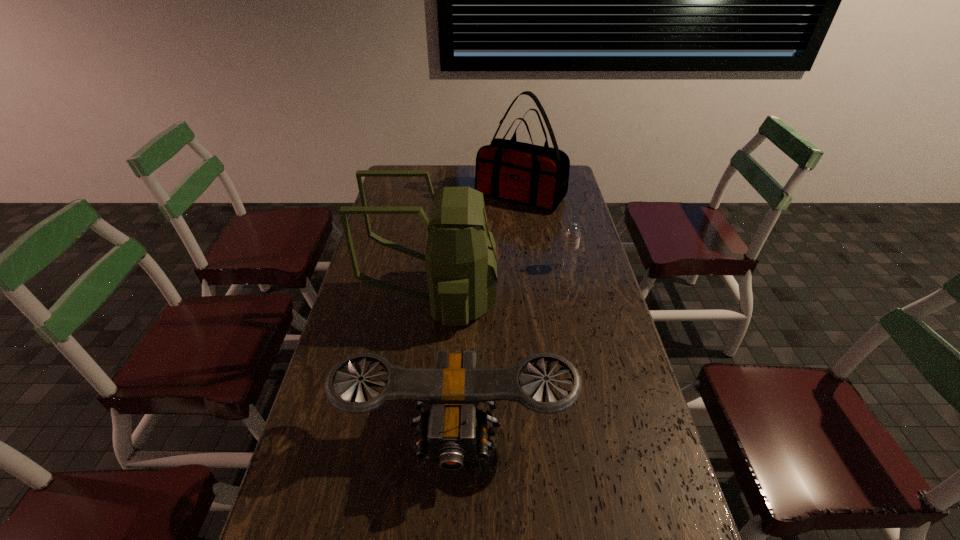
This screenshot has height=540, width=960. In order to click on drone that is positioned at the left edge in this screenshot , I will do `click(453, 426)`.

At what (x,y) coordinates should I click in order to perform the action: click on duffel bag situated at the right edge. Please return your answer as a coordinate pair (x, y). This screenshot has width=960, height=540. Looking at the image, I should click on (537, 176).

Find the location of a particular element. This screenshot has width=960, height=540. water bottle that is at the right edge is located at coordinates (570, 251).

Where is `object that is at the far right corner`? The height and width of the screenshot is (540, 960). object that is at the far right corner is located at coordinates (537, 176).

In order to click on vacant area at the far edge in this screenshot , I will do `click(432, 183)`.

Where is `free spot at the left edge of the desktop`? free spot at the left edge of the desktop is located at coordinates (401, 267).

This screenshot has height=540, width=960. I want to click on free spot at the right edge of the desktop, so click(553, 253).

In the image, there is a desktop. Identify the location of blank space at the far left corner. The width and height of the screenshot is (960, 540). (412, 186).

At what (x,y) coordinates should I click in order to perform the action: click on vacant space that is in between the drone and the water bottle. Please return your answer as a coordinate pair (x, y). Looking at the image, I should click on (512, 352).

At what (x,y) coordinates should I click in order to perform the action: click on free space that is in between the farthest object and the shortest object. Please return your answer as a coordinate pair (x, y). This screenshot has width=960, height=540. Looking at the image, I should click on click(544, 232).